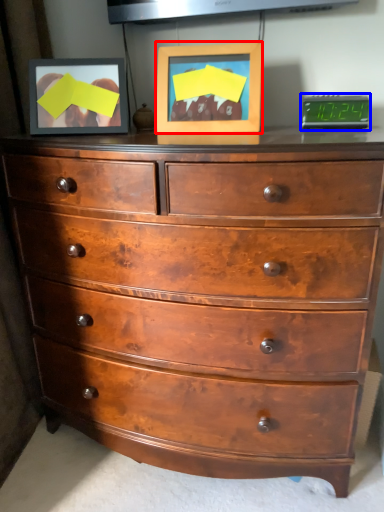
Question: Among these objects, which one is farthest to the camera, picture frame (highlighted by a red box) or alarm clock (highlighted by a blue box)?

Choices:
 (A) picture frame
 (B) alarm clock

Answer: (B)